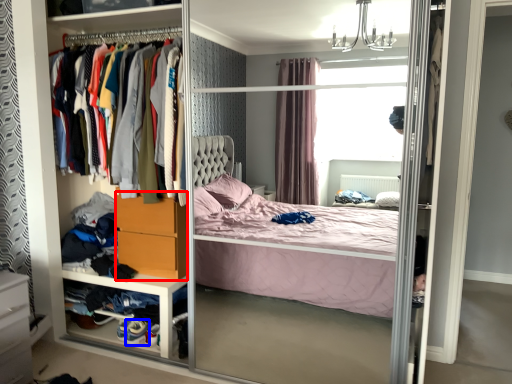
Question: Which object is further to the camera taking this photo, dresser (highlighted by a red box) or shoe (highlighted by a blue box)?

Choices:
 (A) dresser
 (B) shoe

Answer: (B)